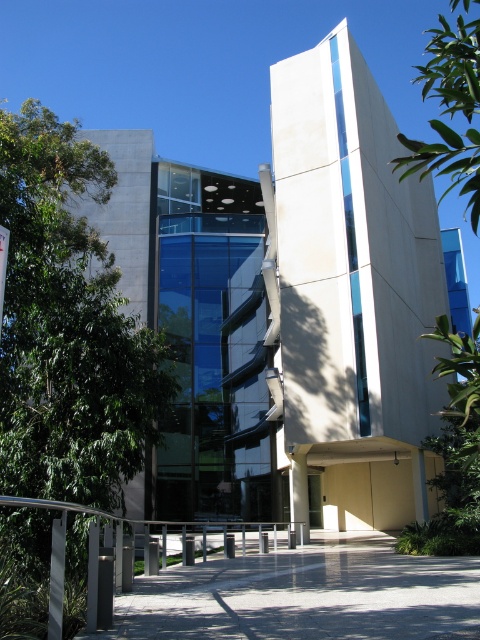
Can you confirm if silver metallic railing at lower center is smaller than green leafy tree at upper right?

Correct, silver metallic railing at lower center occupies less space than green leafy tree at upper right.

Locate an element on the screen. The width and height of the screenshot is (480, 640). silver metallic railing at lower center is located at coordinates (153, 545).

Between green leafy tree at left and silver metallic railing at lower center, which one appears on the left side from the viewer's perspective?

Positioned to the left is green leafy tree at left.

Does green leafy tree at left have a lesser width compared to silver metallic railing at lower center?

Yes, green leafy tree at left is thinner than silver metallic railing at lower center.

Measure the distance between point (90, 170) and camera.

Point (90, 170) and camera are 17.80 meters apart from each other.

Identify the location of green leafy tree at left. The height and width of the screenshot is (640, 480). (68, 326).

The image size is (480, 640). Identify the location of green leafy tree at left. (68, 326).

Who is lower down, green leafy tree at left or glass door at center?

Positioned lower is glass door at center.

The width and height of the screenshot is (480, 640). What are the coordinates of `green leafy tree at left` in the screenshot? It's located at (68, 326).